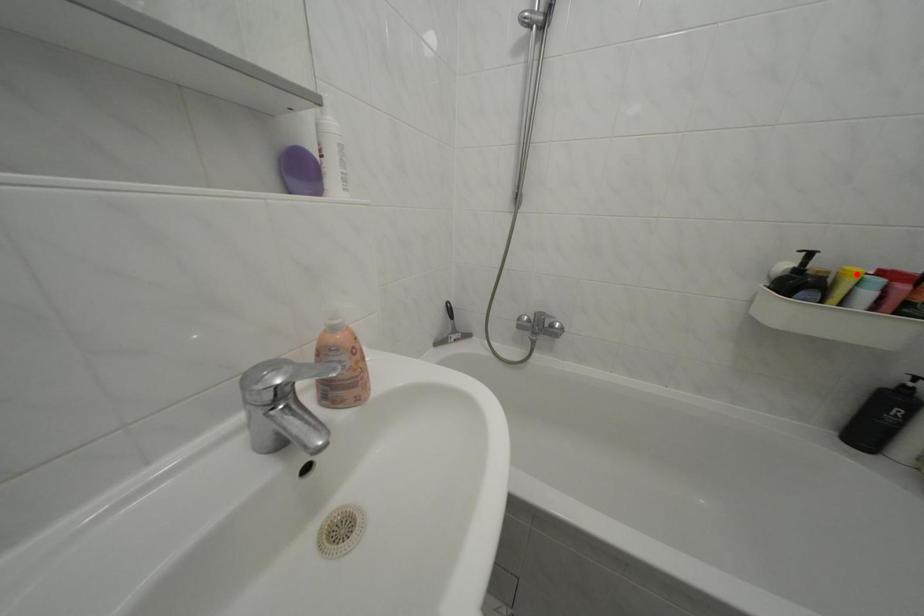
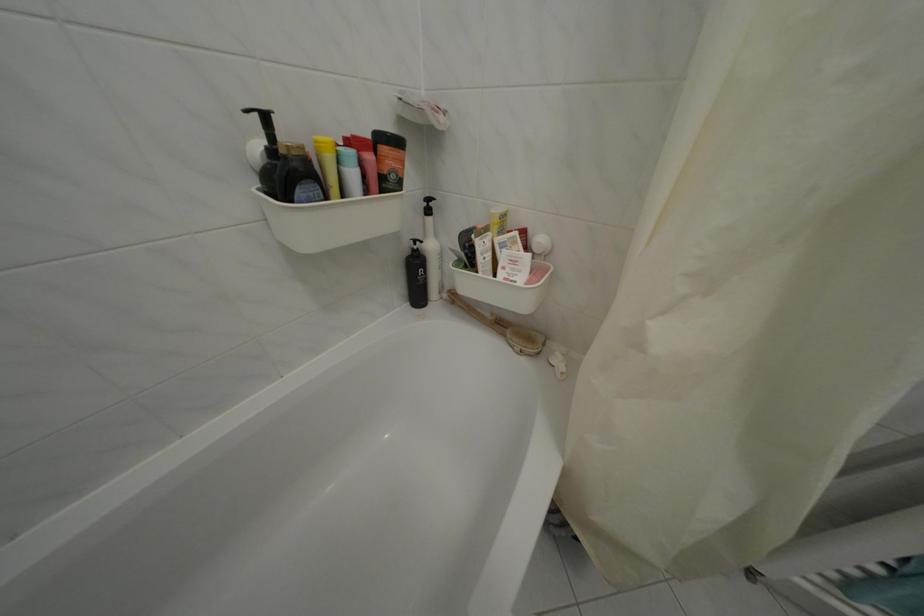
Find the pixel in the second image that matches the highlighted location in the first image.

(325, 144)